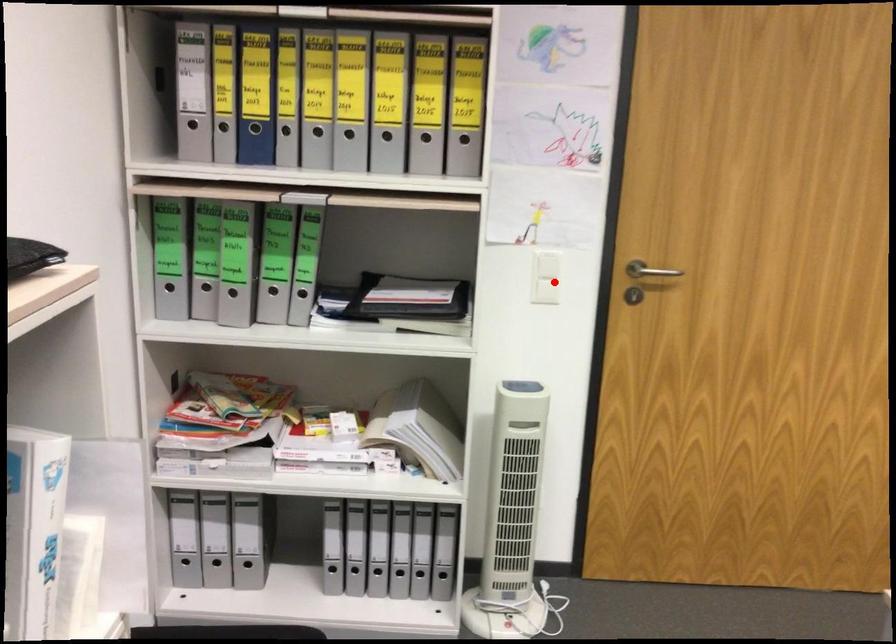
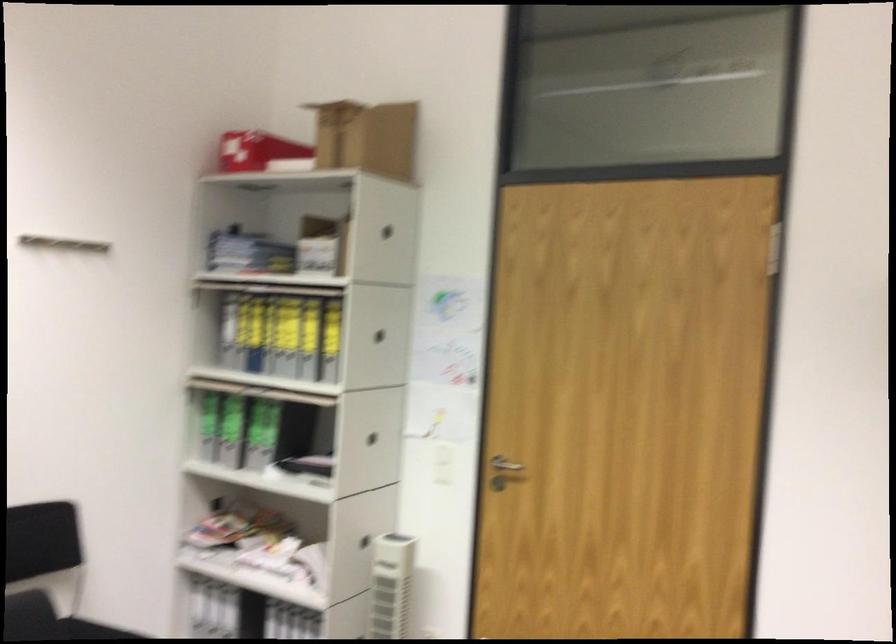
Find the pixel in the second image that matches the highlighted location in the first image.

(444, 462)